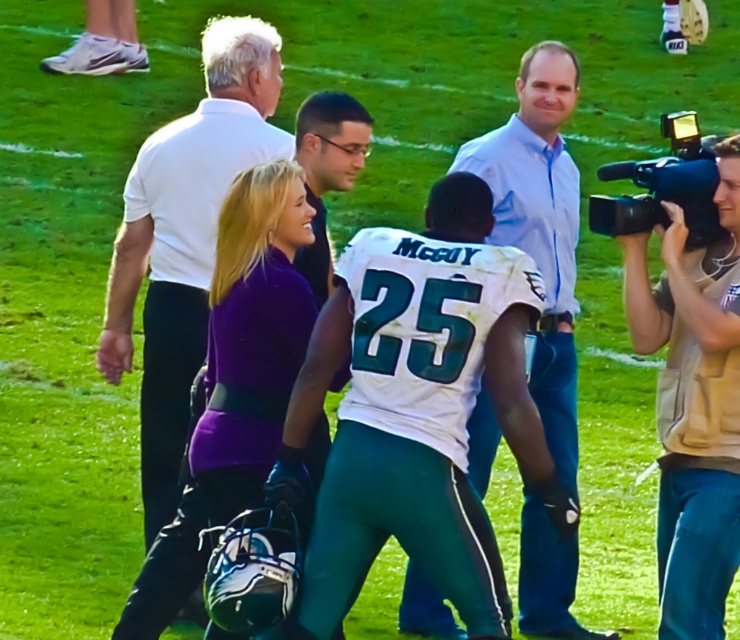
Question: Estimate the real-world distances between objects in this image. Which object is closer to the light blue shirt at center?

Choices:
 (A) black plastic video camera at right
 (B) beige fabric camera at right

Answer: (A)

Question: Which point appears closest to the camera in this image?

Choices:
 (A) coord(545,365)
 (B) coord(175,468)
 (C) coord(673,307)

Answer: (C)

Question: Is light blue shirt at center below black plastic video camera at right?

Choices:
 (A) yes
 (B) no

Answer: (A)

Question: Where is white smooth shirt at upper left located in relation to light blue shirt at center in the image?

Choices:
 (A) left
 (B) right

Answer: (A)

Question: Which point is closer to the camera?

Choices:
 (A) (639, 172)
 (B) (204, 109)
 (C) (699, 252)
 (D) (568, 541)

Answer: (C)

Question: Observing the image, what is the correct spatial positioning of white smooth shirt at upper left in reference to black plastic video camera at right?

Choices:
 (A) right
 (B) left

Answer: (B)